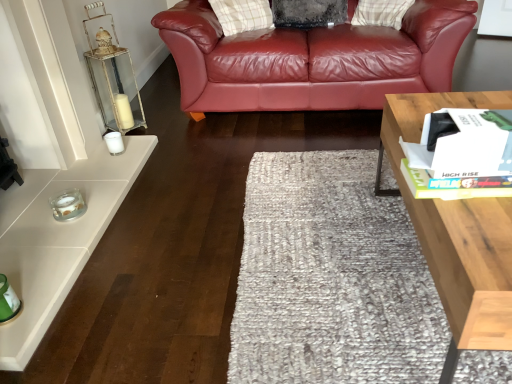
Question: From a real-world perspective, is white glass candle at left, which is the second candle holder in bottom-to-top order, located higher than light wood/texture coffee table at right?

Choices:
 (A) no
 (B) yes

Answer: (A)

Question: Is white glass candle at left, arranged as the first candle holder when viewed from the top, surrounding light wood/texture coffee table at right?

Choices:
 (A) no
 (B) yes

Answer: (A)

Question: Can you confirm if white glass candle at left, marked as the 2th candle holder in a front-to-back arrangement, is wider than light wood/texture coffee table at right?

Choices:
 (A) yes
 (B) no

Answer: (B)

Question: Does white glass candle at left, which is the second candle holder in bottom-to-top order, have a smaller size compared to light wood/texture coffee table at right?

Choices:
 (A) yes
 (B) no

Answer: (A)

Question: Does white glass candle at left, marked as the 2th candle holder in a front-to-back arrangement, turn towards light wood/texture coffee table at right?

Choices:
 (A) no
 (B) yes

Answer: (B)

Question: From the image's perspective, relative to light wood/texture coffee table at right, is white glass candle at left, arranged as the first candle holder when viewed from the top, above or below?

Choices:
 (A) below
 (B) above

Answer: (B)

Question: Is white glass candle at left, marked as the 2th candle holder in a front-to-back arrangement, wider or thinner than light wood/texture coffee table at right?

Choices:
 (A) thin
 (B) wide

Answer: (A)

Question: From a real-world perspective, is white glass candle at left, arranged as the first candle holder when viewed from the top, above or below light wood/texture coffee table at right?

Choices:
 (A) above
 (B) below

Answer: (B)

Question: Choose the correct answer: Is white glass candle at left, marked as the 2th candle holder in a front-to-back arrangement, inside light wood/texture coffee table at right or outside it?

Choices:
 (A) outside
 (B) inside

Answer: (A)

Question: Looking at their shapes, would you say clear glass candle at lower left, which is counted as the second candle holder, starting from the back, is wider or thinner than light wood/texture coffee table at right?

Choices:
 (A) thin
 (B) wide

Answer: (A)

Question: Looking at the image, does clear glass candle at lower left, which is counted as the 1th candle holder, starting from the bottom, seem bigger or smaller compared to light wood/texture coffee table at right?

Choices:
 (A) big
 (B) small

Answer: (B)

Question: From a real-world perspective, is clear glass candle at lower left, acting as the second candle holder starting from the top, positioned above or below light wood/texture coffee table at right?

Choices:
 (A) above
 (B) below

Answer: (B)

Question: Choose the correct answer: Is clear glass candle at lower left, which is counted as the 1th candle holder, starting from the bottom, inside light wood/texture coffee table at right or outside it?

Choices:
 (A) inside
 (B) outside

Answer: (B)

Question: From the image's perspective, is white glass candle at left, the first candle holder from the back, located above or below clear glass candle at lower left, which is counted as the second candle holder, starting from the back?

Choices:
 (A) below
 (B) above

Answer: (B)

Question: In the image, is white glass candle at left, marked as the 2th candle holder in a front-to-back arrangement, positioned in front of or behind clear glass candle at lower left, acting as the first candle holder starting from the front?

Choices:
 (A) behind
 (B) front

Answer: (A)